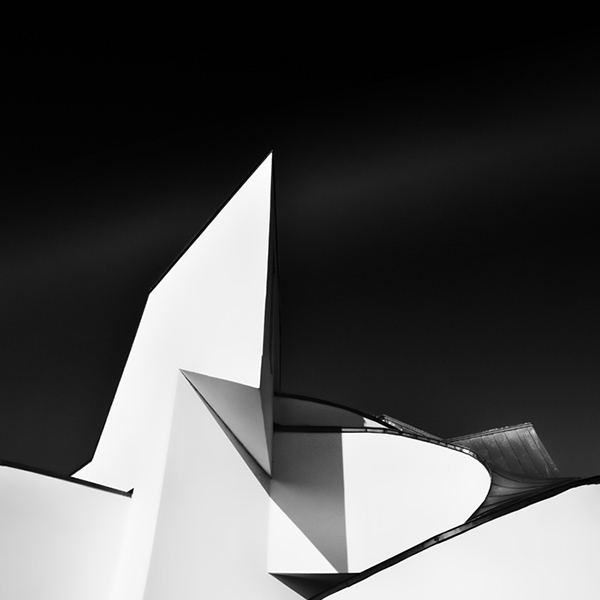
This screenshot has width=600, height=600. Identify the location of pieces of sculpture. tap(75, 540), tap(116, 445), tap(215, 321), tap(237, 411), tap(397, 521), tap(305, 412), tap(216, 535), tap(525, 567), tap(529, 480), tap(530, 451).